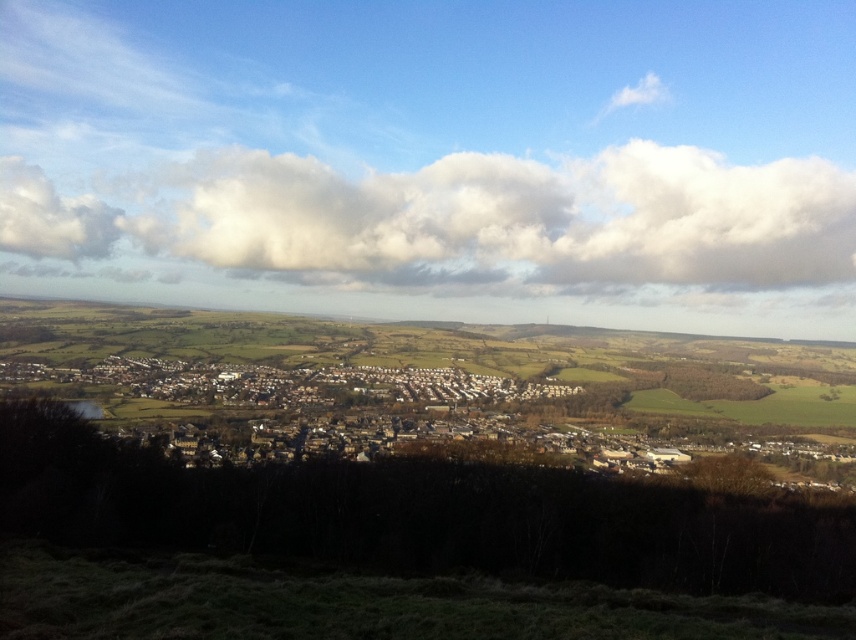
Which of these two, white fluffy cloud at upper center or white matte buildings at center, stands taller?

With more height is white fluffy cloud at upper center.

The image size is (856, 640). What are the coordinates of `white fluffy cloud at upper center` in the screenshot? It's located at (449, 221).

Locate an element on the screen. The width and height of the screenshot is (856, 640). white fluffy cloud at upper center is located at coordinates (449, 221).